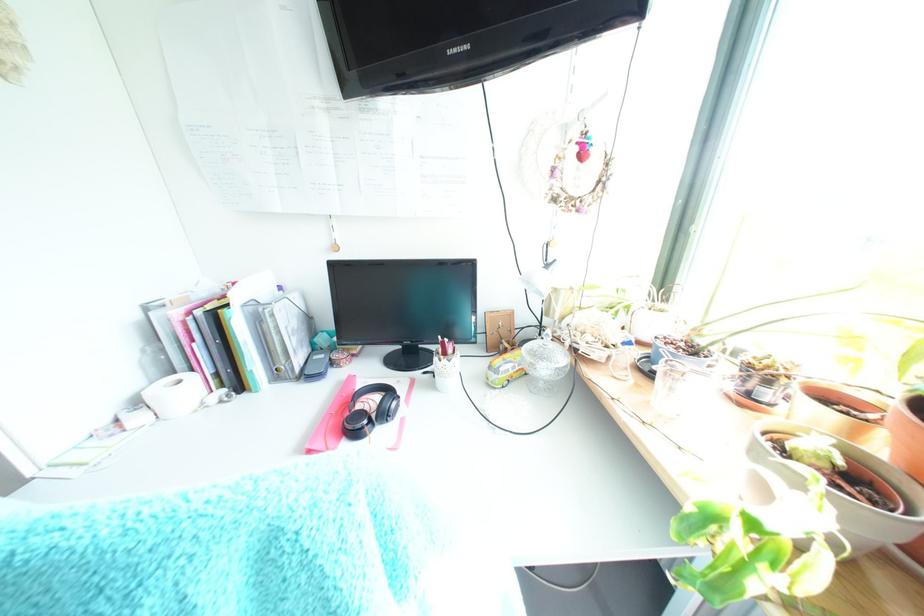
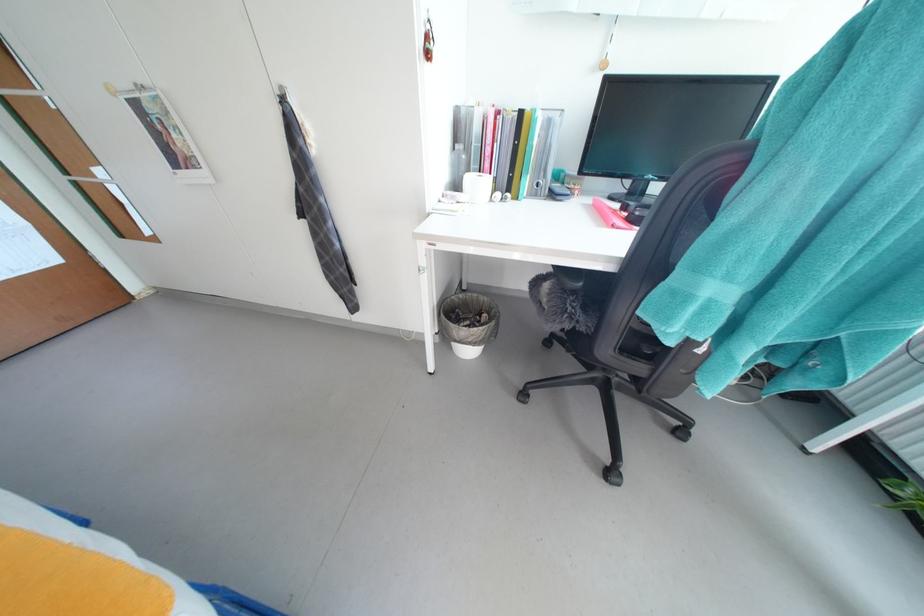
Question: The first image is from the beginning of the video and the second image is from the end. How did the camera likely rotate when shooting the video?

Choices:
 (A) Left
 (B) Right
 (C) Up
 (D) Down

Answer: (D)